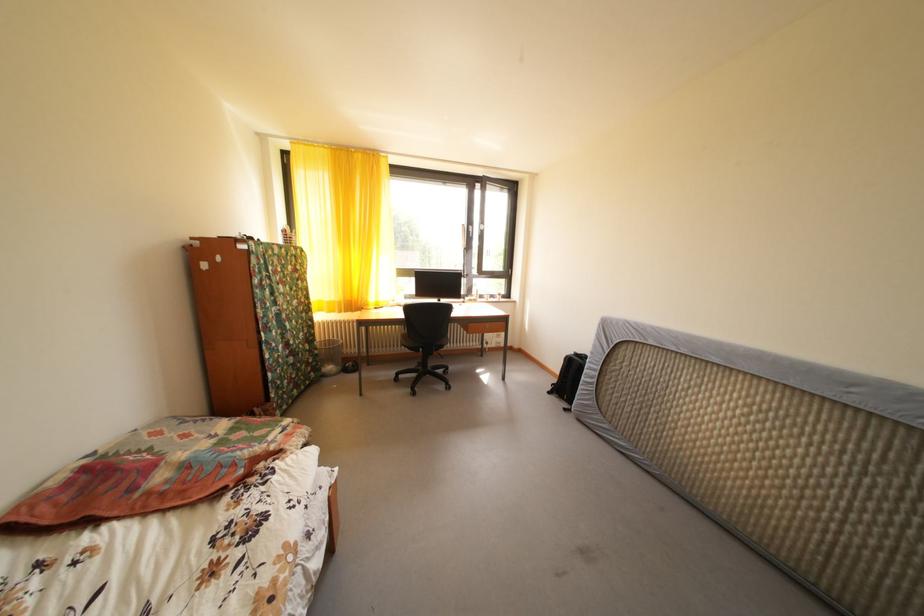
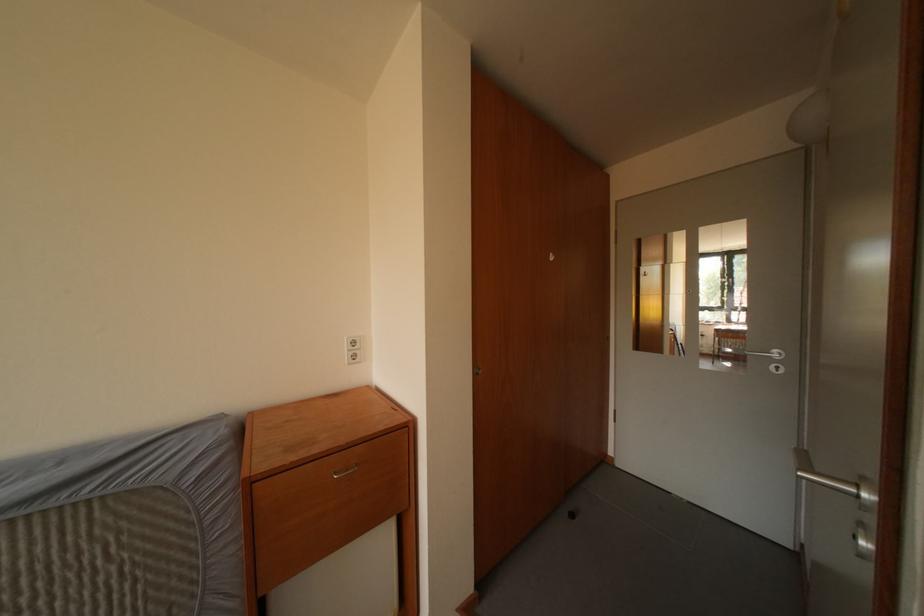
Question: Based on the continuous images, in which direction is the camera rotating? Reply with the corresponding letter.

Choices:
 (A) Left
 (B) Right
 (C) Up
 (D) Down

Answer: (B)